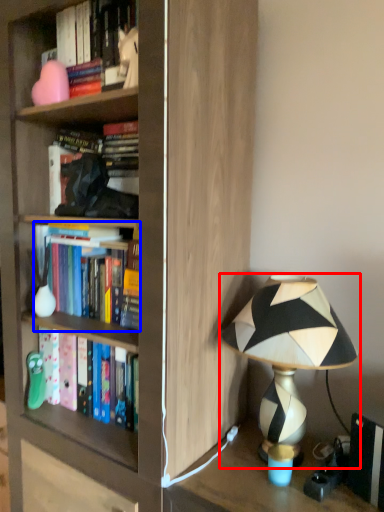
Question: Which of the following is the farthest to the observer, lamp (highlighted by a red box) or book (highlighted by a blue box)?

Choices:
 (A) lamp
 (B) book

Answer: (B)